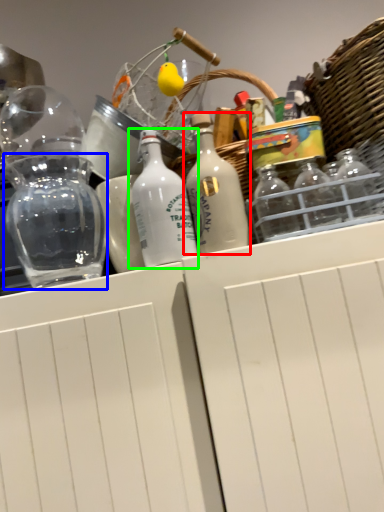
Question: Estimate the real-world distances between objects in this image. Which object is closer to bottle (highlighted by a red box), glass jar (highlighted by a blue box) or bottle (highlighted by a green box)?

Choices:
 (A) glass jar
 (B) bottle

Answer: (B)